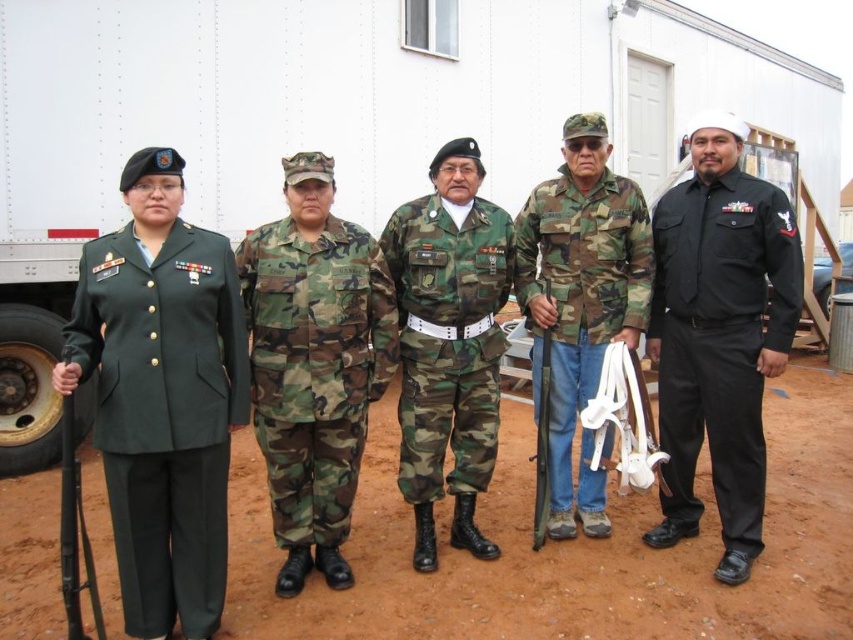
Question: Is camo fabric uniform at center thinner than camo fabric jacket at center?

Choices:
 (A) yes
 (B) no

Answer: (A)

Question: Which object is the closest to the camo fabric jacket at center?

Choices:
 (A) camo fabric uniform at center
 (B) green matte uniform at left

Answer: (A)

Question: Considering the real-world distances, which object is farthest from the camo fabric jacket at center?

Choices:
 (A) camouflage fabric uniform at center
 (B) black smooth uniform at right

Answer: (A)

Question: Is black smooth uniform at right thinner than camo fabric jacket at center?

Choices:
 (A) no
 (B) yes

Answer: (B)

Question: Is green matte uniform at left below camo fabric uniform at center?

Choices:
 (A) no
 (B) yes

Answer: (B)

Question: Which object is positioned farthest from the camouflage fabric uniform at center?

Choices:
 (A) camo fabric jacket at center
 (B) green matte uniform at left

Answer: (A)